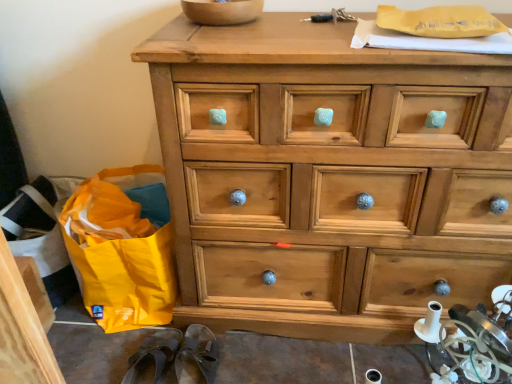
Question: Would you say brown leather slipper at lower left, the second slipper in the right-to-left sequence, is inside or outside yellow fabric bag at lower left?

Choices:
 (A) inside
 (B) outside

Answer: (B)

Question: Would you say brown leather slipper at lower left, the first slipper in the left-to-right sequence, is to the left or to the right of yellow fabric bag at lower left in the picture?

Choices:
 (A) left
 (B) right

Answer: (B)

Question: Which is nearer to the yellow fabric bag at lower left?

Choices:
 (A) wooden bowl at upper center
 (B) brown leather slipper at lower left, the first slipper in the left-to-right sequence
 (C) brown leather slipper at lower center, which ranks as the 2th slipper in left-to-right order
 (D) natural wood chest of drawers at center

Answer: (B)

Question: Which object is positioned farthest from the wooden bowl at upper center?

Choices:
 (A) yellow fabric bag at lower left
 (B) brown leather slipper at lower left, the second slipper in the right-to-left sequence
 (C) natural wood chest of drawers at center
 (D) brown leather slipper at lower center, which ranks as the 2th slipper in left-to-right order

Answer: (B)